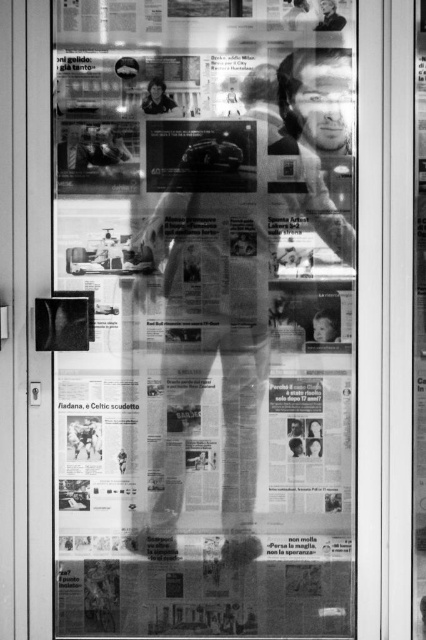
Question: Does printed paper poster at center lie in front of smooth skin person at upper center?

Choices:
 (A) yes
 (B) no

Answer: (A)

Question: Where is printed paper poster at center located in relation to smooth skin person at upper center in the image?

Choices:
 (A) below
 (B) above

Answer: (A)

Question: Which of the following is the farthest from the observer?

Choices:
 (A) smooth skin person at upper center
 (B) printed paper poster at center

Answer: (A)

Question: Among these points, which one is farthest from the camera?

Choices:
 (A) (181, 356)
 (B) (164, 86)

Answer: (A)

Question: Does printed paper poster at center appear over smooth skin person at upper center?

Choices:
 (A) yes
 (B) no

Answer: (B)

Question: Which of the following is the closest to the observer?

Choices:
 (A) smooth skin person at upper center
 (B) printed paper poster at center

Answer: (B)